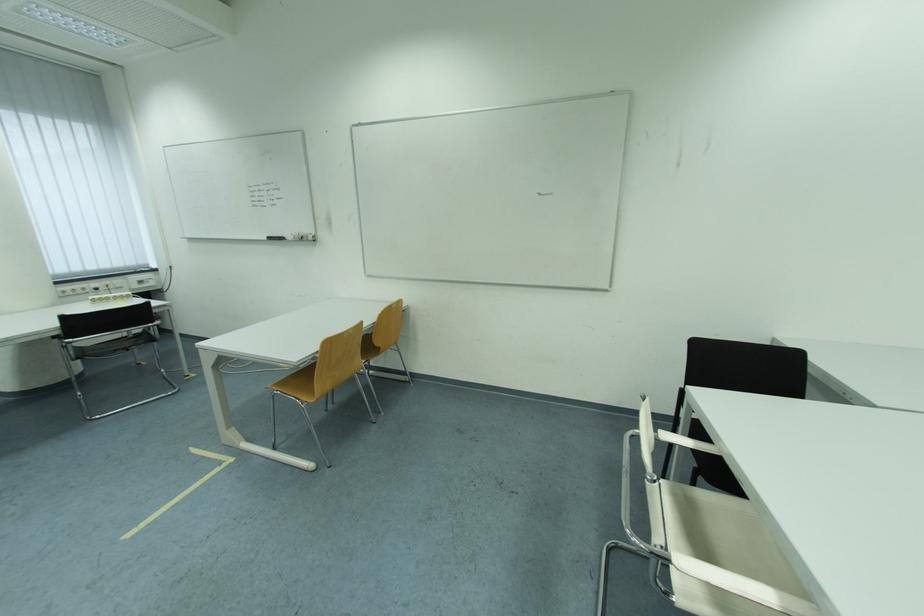
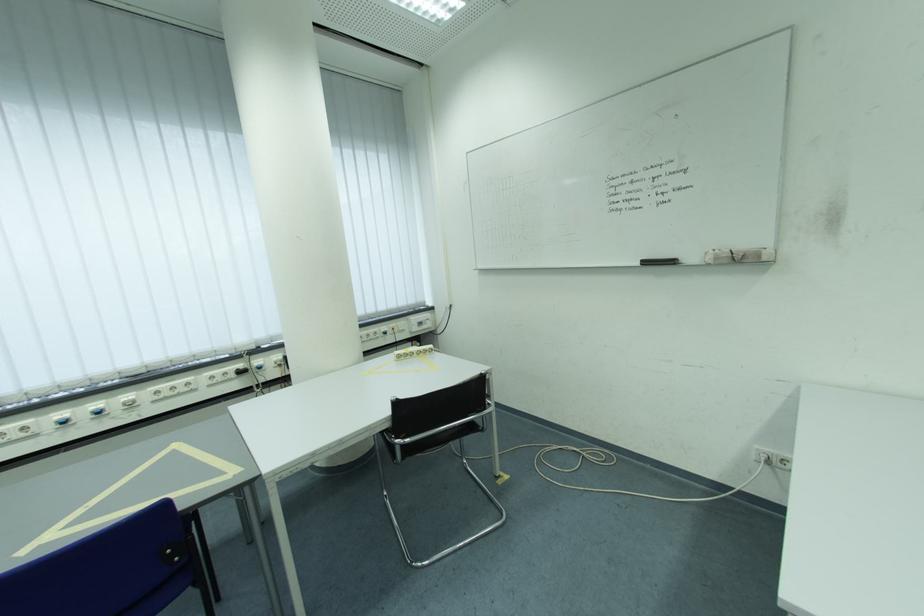
In a continuous first-person perspective shot, in which direction is the camera moving?

The movement direction of the cameraman is left, forward.